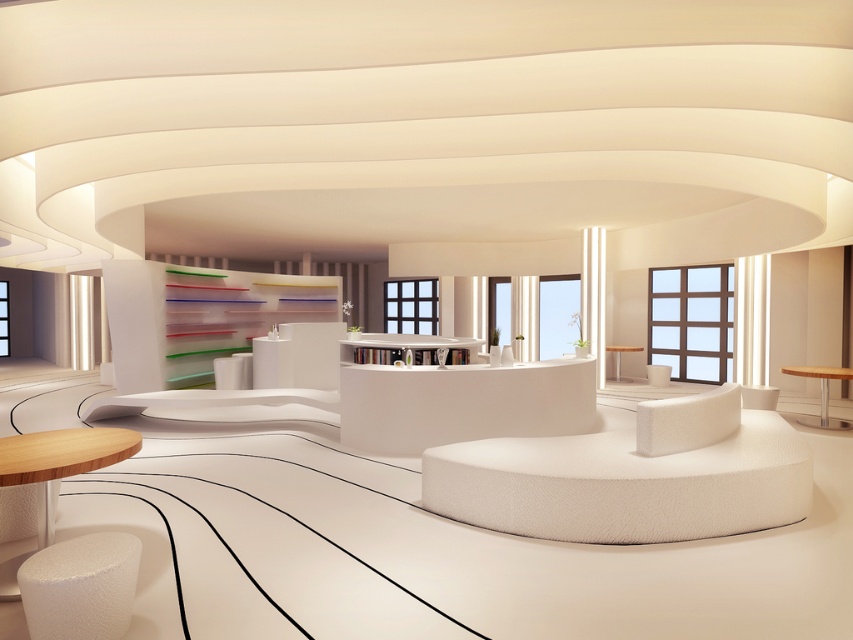
Looking at this image, can you confirm if satin white stool at lower left is taller than wooden table at lower right?

Incorrect, satin white stool at lower left's height is not larger of wooden table at lower right's.

Which is behind, point (126, 544) or point (795, 372)?

The point (795, 372) is behind.

I want to click on satin white stool at lower left, so click(80, 586).

Who is lower down, satin white stool at lower left or wooden table at center?

Positioned lower is satin white stool at lower left.

Does satin white stool at lower left come behind wooden table at center?

No, satin white stool at lower left is closer to the viewer.

Who is more distant from viewer, (78, 598) or (618, 378)?

The point (618, 378) is behind.

Where is `satin white stool at lower left`? This screenshot has height=640, width=853. satin white stool at lower left is located at coordinates (80, 586).

This screenshot has height=640, width=853. What do you see at coordinates (61, 461) in the screenshot?
I see `light brown wood table at lower left` at bounding box center [61, 461].

Between light brown wood table at lower left and wooden table at lower right, which one has less height?

With less height is light brown wood table at lower left.

Locate an element on the screen. light brown wood table at lower left is located at coordinates (61, 461).

Identify the location of light brown wood table at lower left. (61, 461).